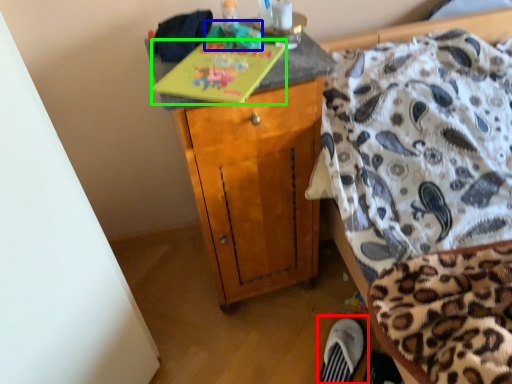
Question: Which object is the closest to the footwear (highlighted by a red box)? Choose among these: toy (highlighted by a blue box) or book (highlighted by a green box).

Choices:
 (A) toy
 (B) book

Answer: (B)